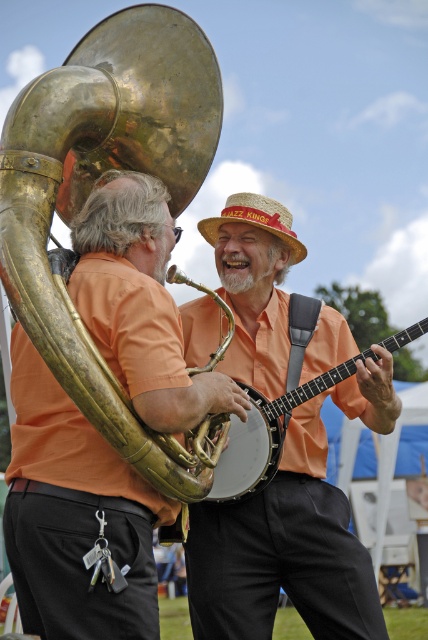
Does gold brass trumpet at upper left have a lesser height compared to strawhat at center?

Incorrect, gold brass trumpet at upper left's height does not fall short of strawhat at center's.

Does gold brass trumpet at upper left have a greater width compared to strawhat at center?

Correct, the width of gold brass trumpet at upper left exceeds that of strawhat at center.

Does point (178, 161) come in front of point (234, 211)?

Yes.

This screenshot has width=428, height=640. What are the coordinates of `gold brass trumpet at upper left` in the screenshot? It's located at (95, 177).

This screenshot has height=640, width=428. What are the coordinates of `matte orange shirt at center` in the screenshot? It's located at (291, 534).

Between matte orange shirt at center and gold brass trumpet at upper left, which one appears on the right side from the viewer's perspective?

matte orange shirt at center is more to the right.

What do you see at coordinates (291, 534) in the screenshot? I see `matte orange shirt at center` at bounding box center [291, 534].

In order to click on matte orange shirt at center in this screenshot , I will do `click(291, 534)`.

Does matte orange shirt at center have a greater height compared to matte gold banjo at center?

Yes.

Is matte orange shirt at center thinner than matte gold banjo at center?

No.

Who is more forward, (262, 579) or (388, 346)?

Positioned in front is point (262, 579).

Identify the location of matte orange shirt at center. This screenshot has height=640, width=428. [291, 534].